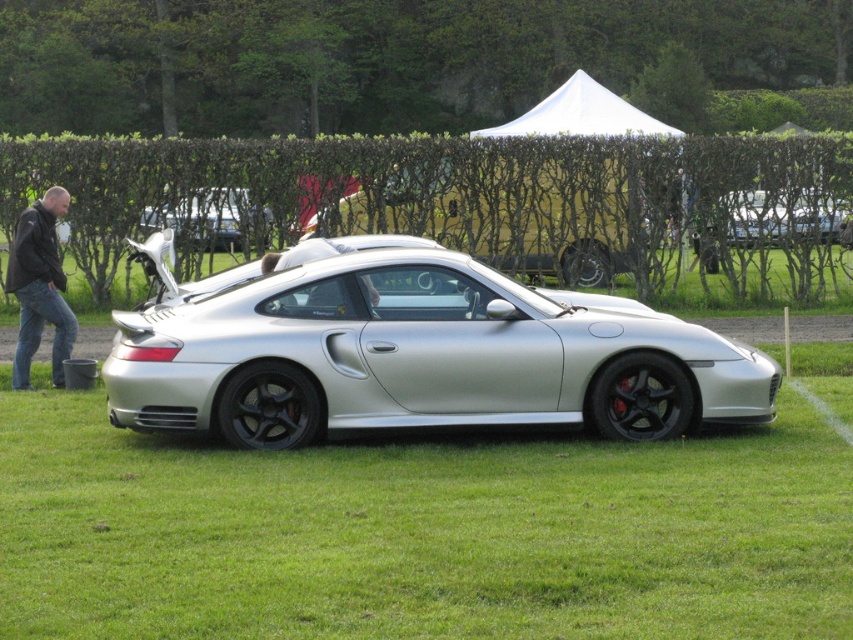
Question: Does green leafy hedge at center have a larger size compared to silver metallic sports car at center?

Choices:
 (A) yes
 (B) no

Answer: (A)

Question: Can you confirm if green grass at center is smaller than green leafy hedge at center?

Choices:
 (A) no
 (B) yes

Answer: (B)

Question: Which object is positioned farthest from the green leafy hedge at center?

Choices:
 (A) green grass at center
 (B) silver metallic sports car at center
 (C) jeans at left

Answer: (A)

Question: Is green leafy hedge at center wider than silver metallic sports car at center?

Choices:
 (A) yes
 (B) no

Answer: (A)

Question: Estimate the real-world distances between objects in this image. Which object is closer to the jeans at left?

Choices:
 (A) silver metallic sports car at center
 (B) green grass at center
 (C) satin silver car at center
 (D) green leafy hedge at center

Answer: (A)

Question: Which object is closer to the camera taking this photo?

Choices:
 (A) jeans at left
 (B) green leafy hedge at center

Answer: (A)